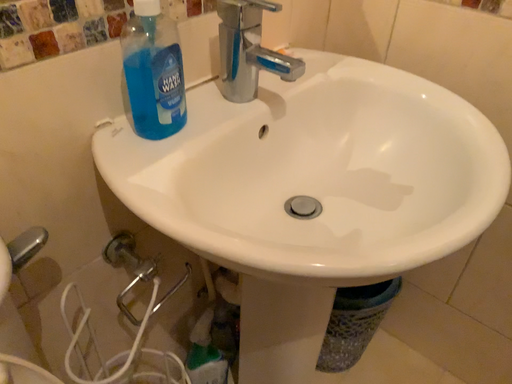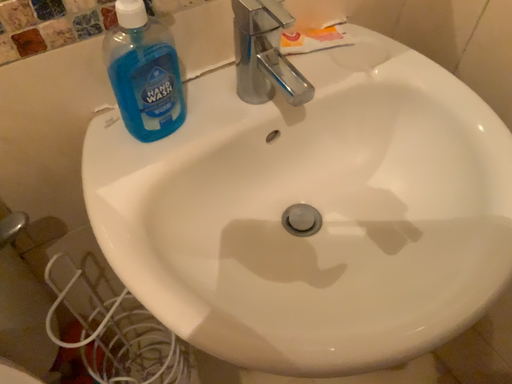
Question: Which way did the camera rotate in the video?

Choices:
 (A) rotated right
 (B) rotated left

Answer: (B)